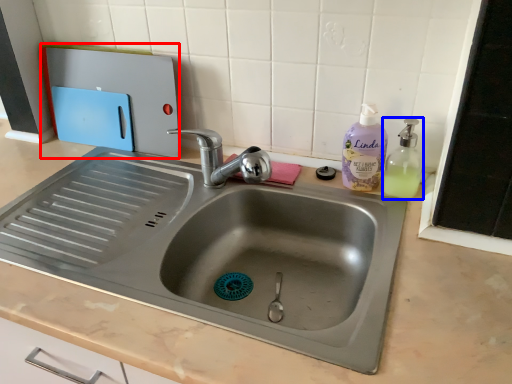
Question: Which of the following is the farthest to the observer, appliance (highlighted by a red box) or soap dispenser (highlighted by a blue box)?

Choices:
 (A) appliance
 (B) soap dispenser

Answer: (A)